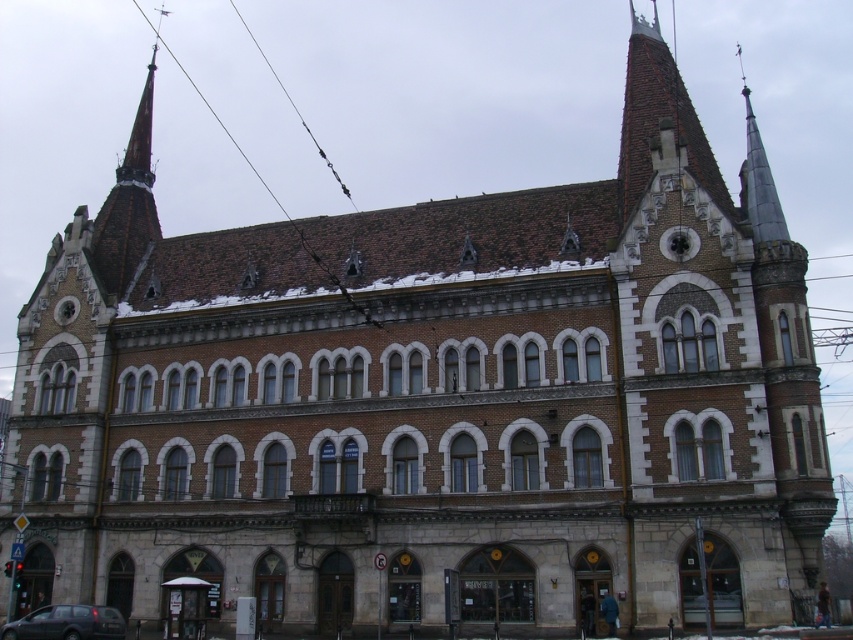
Is dark gray metallic van at lower left positioned before brown wire at upper center?

Yes, it is in front of brown wire at upper center.

Between dark gray metallic van at lower left and brown wire at upper center, which one has less height?

dark gray metallic van at lower left is shorter.

Where is `dark gray metallic van at lower left`? dark gray metallic van at lower left is located at coordinates (67, 624).